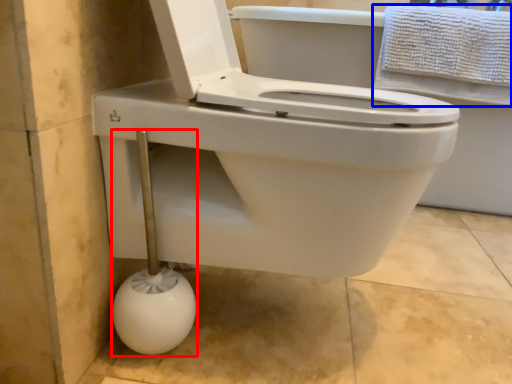
Question: Which point is closer to the camera, shower (highlighted by a red box) or towel (highlighted by a blue box)?

Choices:
 (A) shower
 (B) towel

Answer: (A)